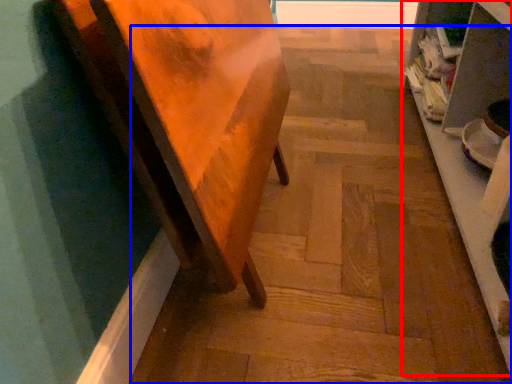
Question: Among these objects, which one is farthest to the camera, shelf (highlighted by a red box) or stair (highlighted by a blue box)?

Choices:
 (A) shelf
 (B) stair

Answer: (B)